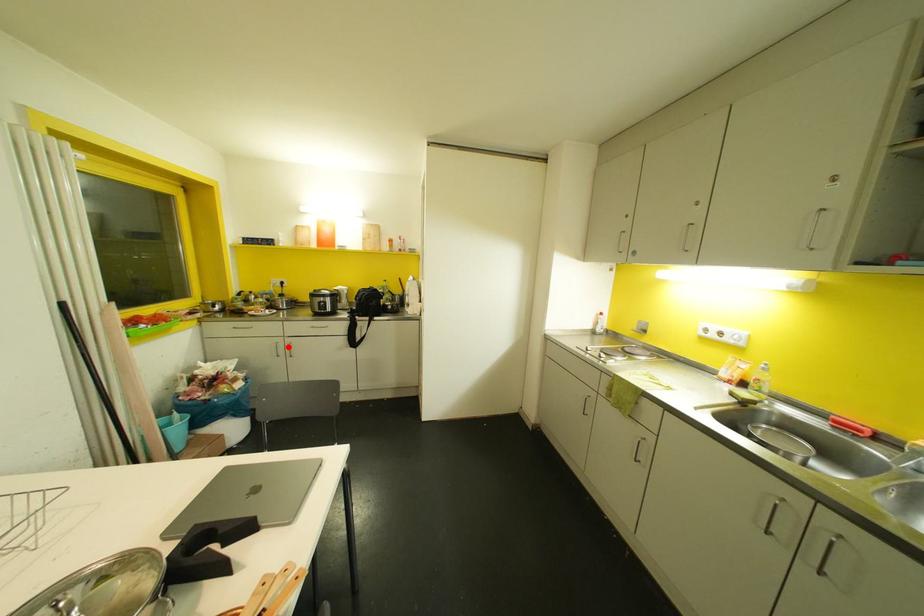
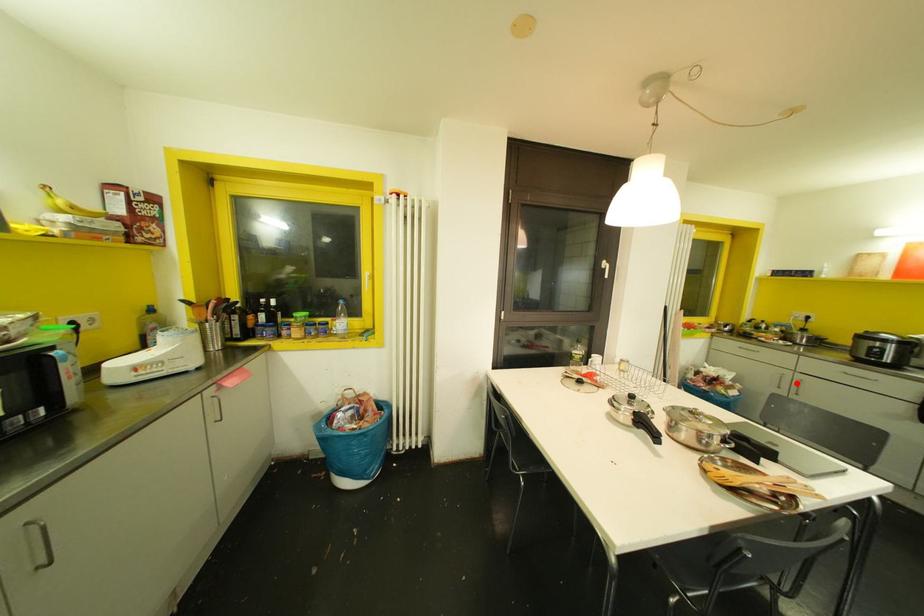
I am providing you with two images of the same scene from different viewpoints. A red point is marked on the first image and another point is marked on the second image. Is the red point in image1 aligned with the point shown in image2?

Yes